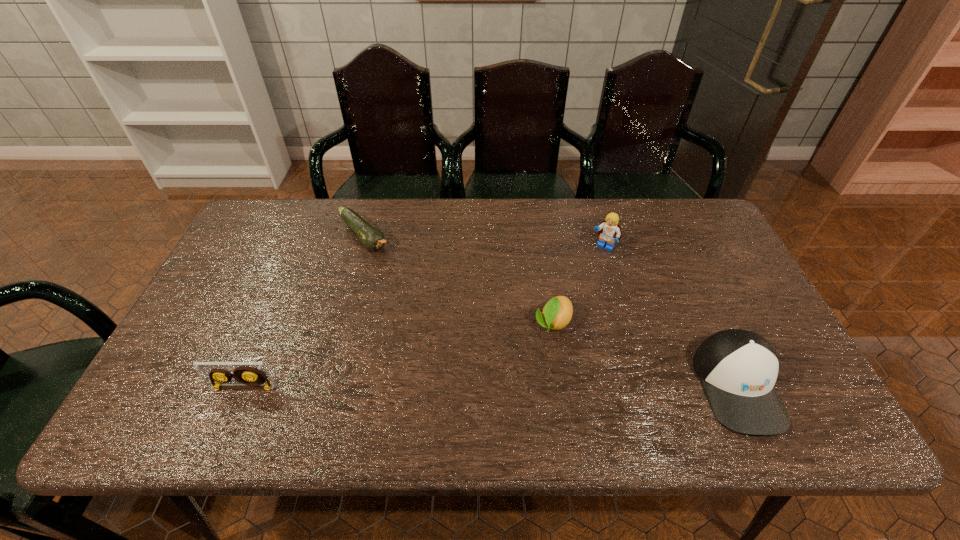
The image size is (960, 540). Identify the location of the leftmost object. (248, 375).

This screenshot has width=960, height=540. In order to click on cap in this screenshot , I will do `click(738, 369)`.

At what (x,y) coordinates should I click in order to perform the action: click on the third object from right to left. Please return your answer as a coordinate pair (x, y). This screenshot has width=960, height=540. Looking at the image, I should click on click(x=557, y=313).

The image size is (960, 540). I want to click on the fourth tallest object, so [x=557, y=313].

Locate an element on the screen. The image size is (960, 540). the fourth object from left to right is located at coordinates (609, 229).

Where is `zucchini`? This screenshot has height=540, width=960. zucchini is located at coordinates (372, 238).

You are a GUI agent. You are given a task and a screenshot of the screen. Output one action in this format:
    pyautogui.click(x=<x>, y=<y>)
    Task: Click on the second object from left to right
    This screenshot has width=960, height=540.
    Given the screenshot: What is the action you would take?
    pyautogui.click(x=372, y=238)

Image resolution: width=960 pixels, height=540 pixels. I want to click on vacant region located with leaves positioned above the fourth tallest object, so click(x=527, y=375).

Locate an element on the screen. vacant space positioned 0.090m with leaves positioned above the fourth tallest object is located at coordinates (532, 365).

Find the location of a particular element. vacant space located with leaves positioned above the fourth tallest object is located at coordinates (535, 359).